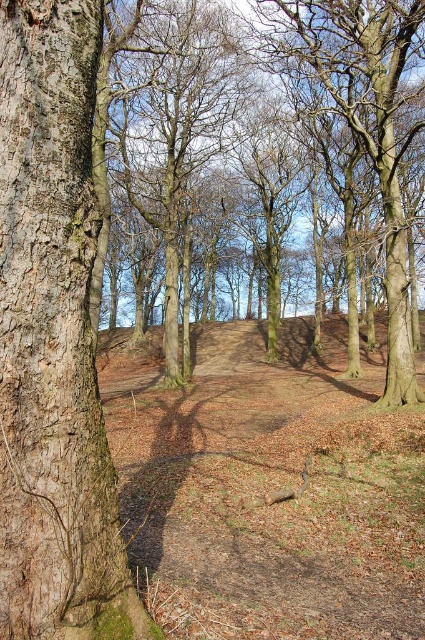
Is smooth brown bark at left to the right of brown rough tree at center from the viewer's perspective?

Indeed, smooth brown bark at left is positioned on the right side of brown rough tree at center.

The image size is (425, 640). I want to click on smooth brown bark at left, so click(53, 340).

In order to click on smooth brown bark at left in this screenshot , I will do click(53, 340).

Can you confirm if smooth brown bark at left is shorter than smooth bark tree at upper center?

Indeed, smooth brown bark at left has a lesser height compared to smooth bark tree at upper center.

Measure the distance from smooth brown bark at left to smooth bark tree at upper center.

smooth brown bark at left is 15.53 meters away from smooth bark tree at upper center.

Describe the element at coordinates (53, 340) in the screenshot. I see `smooth brown bark at left` at that location.

Image resolution: width=425 pixels, height=640 pixels. I want to click on smooth brown bark at left, so click(53, 340).

Who is higher up, brown rough tree at center or smooth bark tree at upper center?

smooth bark tree at upper center is above.

Which of these two, brown rough tree at center or smooth bark tree at upper center, stands taller?

Standing taller between the two is brown rough tree at center.

Which is behind, point (209, 132) or point (397, 349)?

Positioned behind is point (209, 132).

You are a GUI agent. You are given a task and a screenshot of the screen. Output one action in this format:
    pyautogui.click(x=<x>, y=<y>)
    Task: Click on the brown rough tree at center
    The image size is (425, 640).
    Given the screenshot: What is the action you would take?
    pyautogui.click(x=178, y=125)